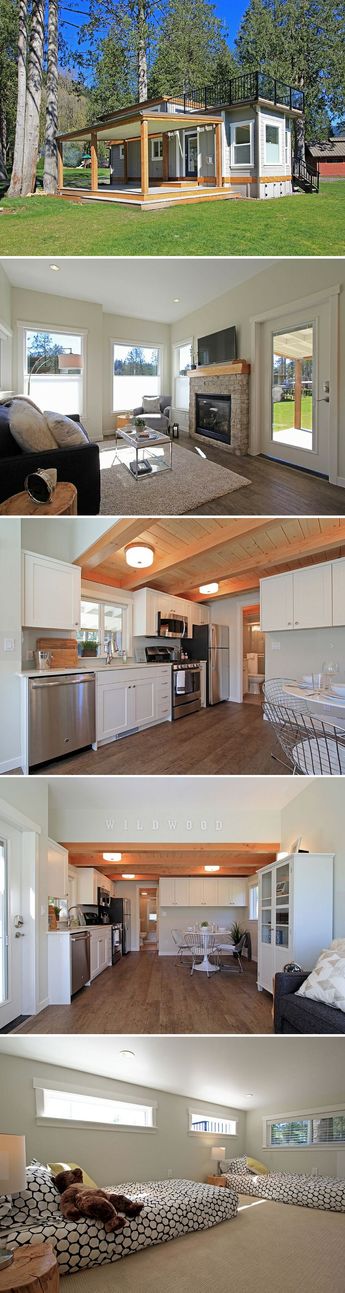
Locate an element on the screen. This screenshot has width=345, height=1293. table is located at coordinates (38, 1257), (215, 1174), (219, 928), (302, 692), (140, 441).